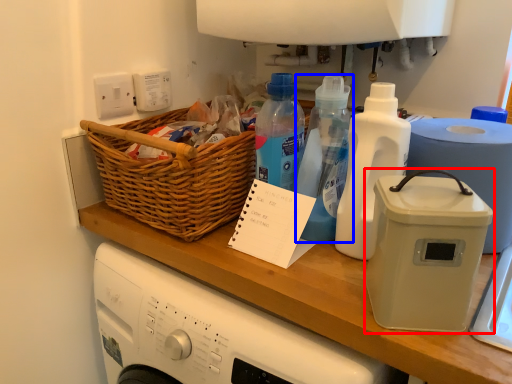
Question: Among these objects, which one is nearest to the camera, kitchen appliance (highlighted by a red box) or bottle (highlighted by a blue box)?

Choices:
 (A) kitchen appliance
 (B) bottle

Answer: (A)